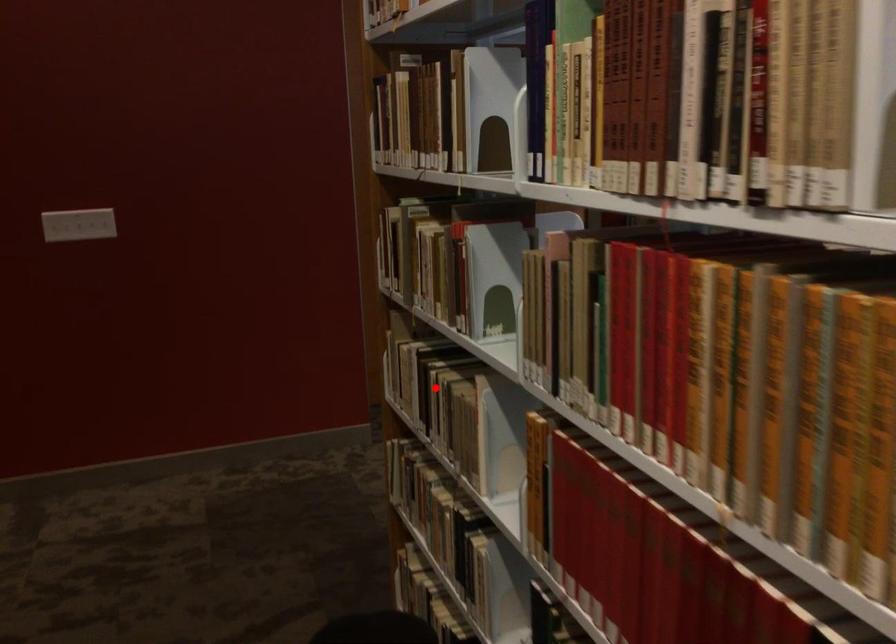
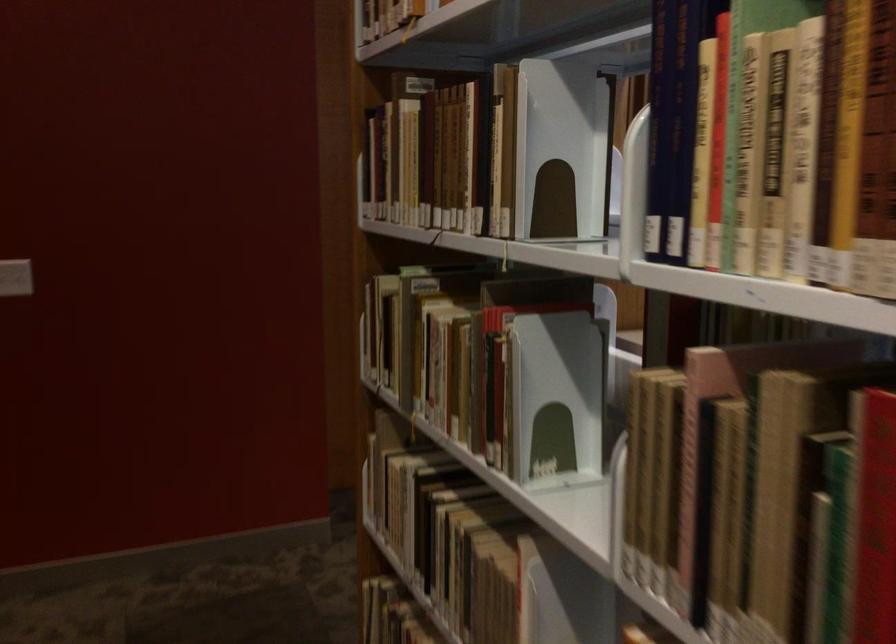
Where in the second image is the point corresponding to the highlighted location from the first image?

(445, 532)